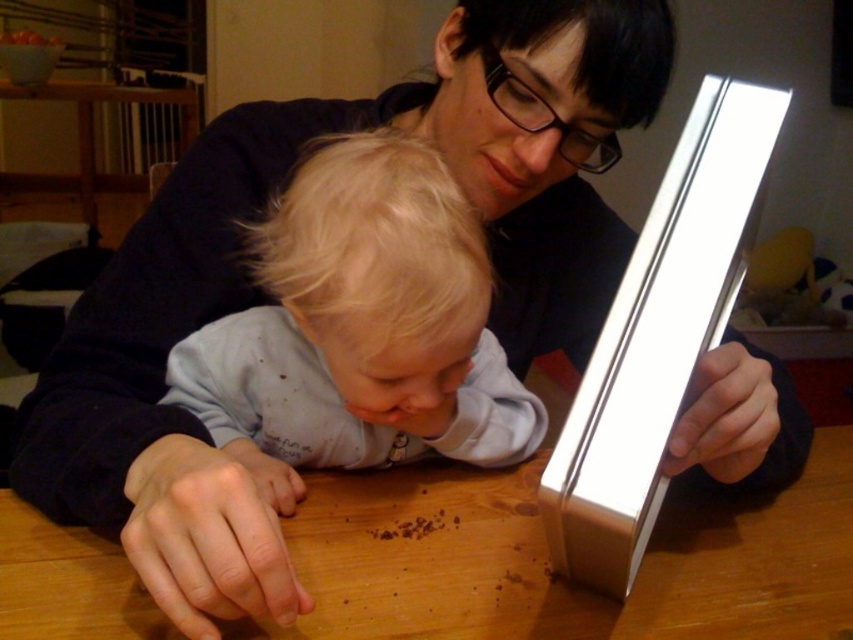
Consider the image. Which of these two, wooden table at center or light blue cotton shirt at center, stands taller?

With more height is light blue cotton shirt at center.

Who is more forward, (x=779, y=525) or (x=270, y=228)?

Point (x=270, y=228) is more forward.

This screenshot has width=853, height=640. Describe the element at coordinates (548, 564) in the screenshot. I see `wooden table at center` at that location.

Identify the location of wooden table at center. (548, 564).